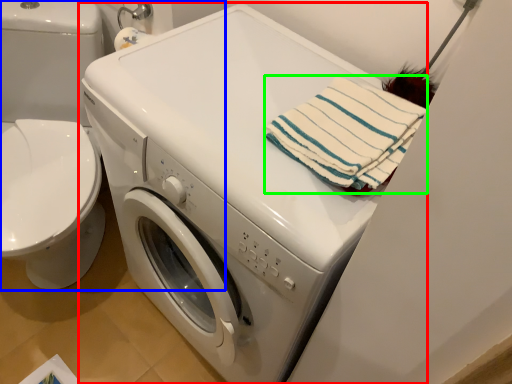
Question: Considering the real-world distances, which object is farthest from washing machine (highlighted by a red box)? washer (highlighted by a blue box) or beach towel (highlighted by a green box)?

Choices:
 (A) washer
 (B) beach towel

Answer: (A)